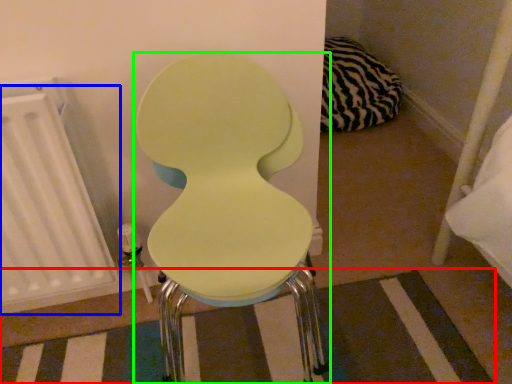
Question: Which object is the closest to the strip (highlighted by a red box)? Choose among these: radiator (highlighted by a blue box) or toilet (highlighted by a green box).

Choices:
 (A) radiator
 (B) toilet

Answer: (A)